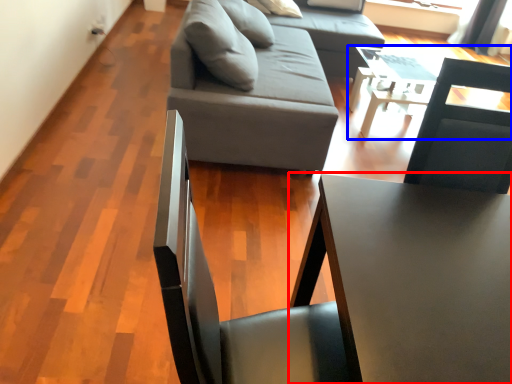
Question: Which object is further to the camera taking this photo, table (highlighted by a red box) or table (highlighted by a blue box)?

Choices:
 (A) table
 (B) table

Answer: (B)